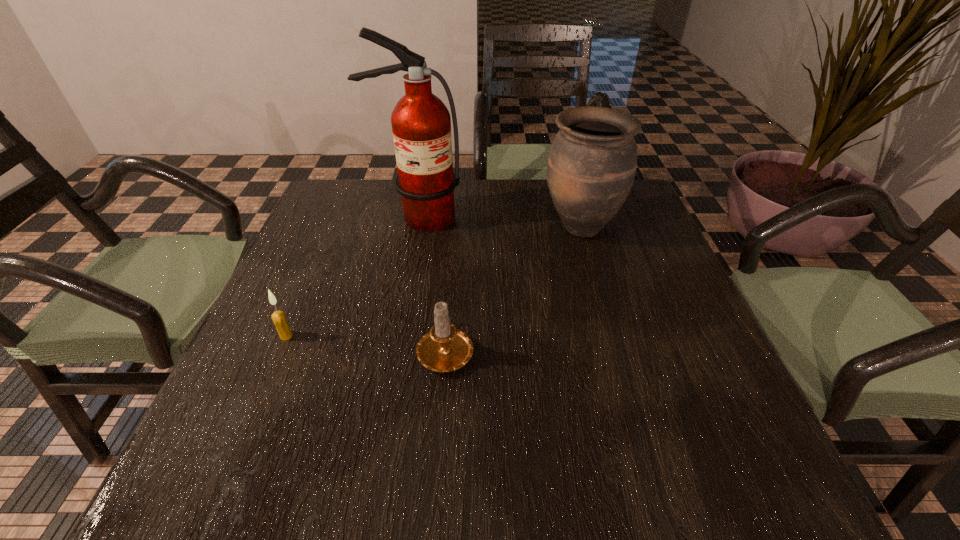
Choose which object is the third nearest neighbor to the rightmost object. Please provide its 2D coordinates. Your answer should be formatted as a tuple, i.e. [(x, y)], where the tuple contains the x and y coordinates of a point satisfying the conditions above.

[(279, 319)]

The width and height of the screenshot is (960, 540). I want to click on the second closest object to the rightmost object, so click(445, 348).

This screenshot has height=540, width=960. I want to click on vacant space that satisfies the following two spatial constraints: 1. on the nozzle and handle of the tallest object; 2. on the left side of the urn, so click(416, 227).

Identify the location of vacant space that satisfies the following two spatial constraints: 1. on the nozzle and handle of the rightmost object; 2. on the left side of the fire extinguisher. Image resolution: width=960 pixels, height=540 pixels. (416, 227).

The width and height of the screenshot is (960, 540). Find the location of `free space that satisfies the following two spatial constraints: 1. on the nozzle and handle of the right candle; 2. on the right side of the fire extinguisher`. free space that satisfies the following two spatial constraints: 1. on the nozzle and handle of the right candle; 2. on the right side of the fire extinguisher is located at coordinates (394, 349).

Where is `free space that satisfies the following two spatial constraints: 1. on the nozzle and handle of the rightmost object; 2. on the right side of the tallest object`? Image resolution: width=960 pixels, height=540 pixels. free space that satisfies the following two spatial constraints: 1. on the nozzle and handle of the rightmost object; 2. on the right side of the tallest object is located at coordinates (416, 227).

Locate an element on the screen. The width and height of the screenshot is (960, 540). vacant space that satisfies the following two spatial constraints: 1. on the nozzle and handle of the third shortest object; 2. on the left side of the tallest object is located at coordinates (416, 227).

This screenshot has width=960, height=540. Find the location of `free space that satisfies the following two spatial constraints: 1. on the nozzle and handle of the tallest object; 2. on the right side of the right candle`. free space that satisfies the following two spatial constraints: 1. on the nozzle and handle of the tallest object; 2. on the right side of the right candle is located at coordinates (394, 349).